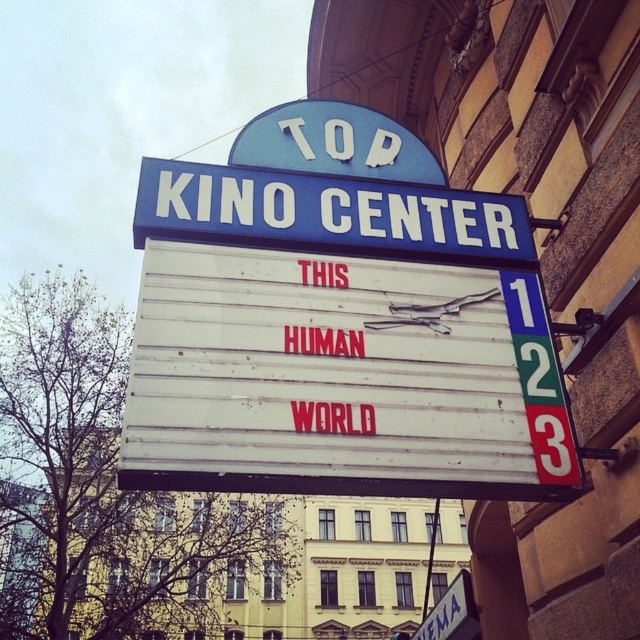
Which is behind, point (184, 198) or point (440, 616)?

The point (440, 616) is behind.

Which is in front, point (461, 205) or point (438, 624)?

Positioned in front is point (461, 205).

In order to click on blue plastic marquee at center in this screenshot , I will do `click(330, 214)`.